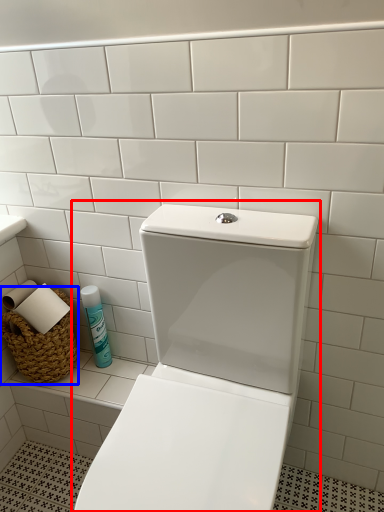
Question: Among these objects, which one is farthest to the camera, toilet (highlighted by a red box) or basket (highlighted by a blue box)?

Choices:
 (A) toilet
 (B) basket

Answer: (B)